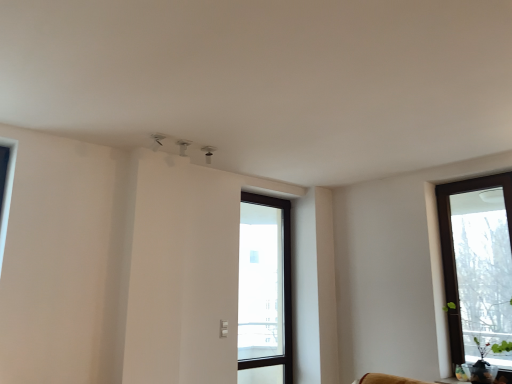
Question: Is brown wooden window at right, the first window from the front, wider or thinner than transparent glass door at center, arranged as the 2th window when viewed from the right?

Choices:
 (A) thin
 (B) wide

Answer: (B)

Question: Is point (496, 327) closer or farther from the camera than point (282, 334)?

Choices:
 (A) farther
 (B) closer

Answer: (B)

Question: From the image's perspective, is brown wooden window at right, arranged as the second window when viewed from the back, above or below transparent glass door at center, arranged as the first window when viewed from the back?

Choices:
 (A) below
 (B) above

Answer: (B)

Question: From the image's perspective, is transparent glass door at center, the second window in the front-to-back sequence, positioned above or below brown wooden window at right, the first window from the front?

Choices:
 (A) below
 (B) above

Answer: (A)

Question: Considering the positions of transparent glass door at center, arranged as the 2th window when viewed from the right, and brown wooden window at right, the first window from the front, in the image, is transparent glass door at center, arranged as the 2th window when viewed from the right, taller or shorter than brown wooden window at right, the first window from the front,?

Choices:
 (A) short
 (B) tall

Answer: (B)

Question: Is transparent glass door at center, the second window in the front-to-back sequence, wider or thinner than brown wooden window at right, the first window from the front?

Choices:
 (A) wide
 (B) thin

Answer: (B)

Question: Is transparent glass door at center, the second window in the front-to-back sequence, inside or outside of brown wooden window at right, the 2th window from the left?

Choices:
 (A) outside
 (B) inside

Answer: (A)